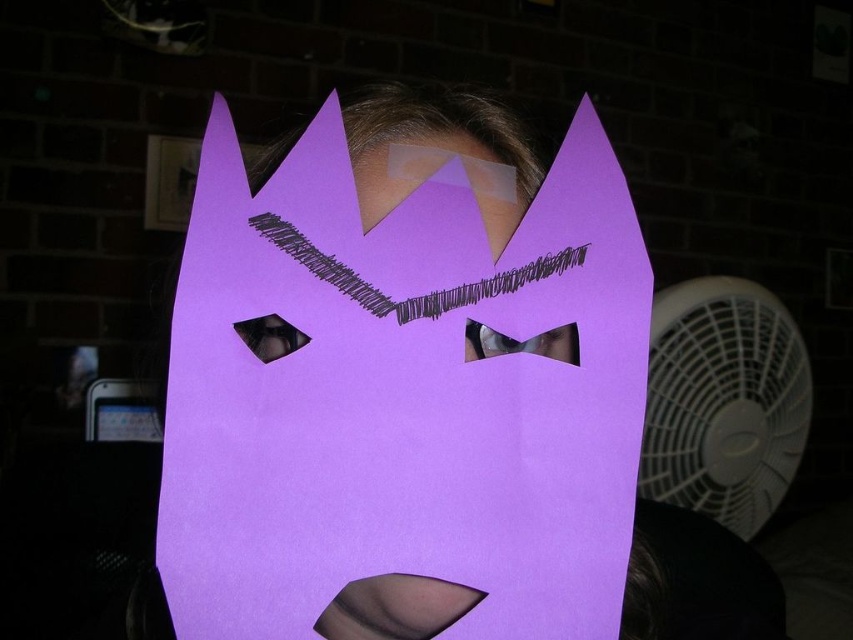
Question: Does purple paper mask at center have a smaller size compared to white plastic fan at right?

Choices:
 (A) no
 (B) yes

Answer: (B)

Question: Which object is farther from the camera taking this photo?

Choices:
 (A) purple paper mask at center
 (B) white plastic fan at right

Answer: (B)

Question: Which of the following is the closest to the observer?

Choices:
 (A) purple paper mask at center
 (B) white plastic fan at right

Answer: (A)

Question: Which of the following is the closest to the observer?

Choices:
 (A) (782, 312)
 (B) (514, 502)

Answer: (B)

Question: From the image, what is the correct spatial relationship of purple paper mask at center in relation to white plastic fan at right?

Choices:
 (A) above
 (B) below

Answer: (A)

Question: Is purple paper mask at center positioned before white plastic fan at right?

Choices:
 (A) no
 (B) yes

Answer: (B)